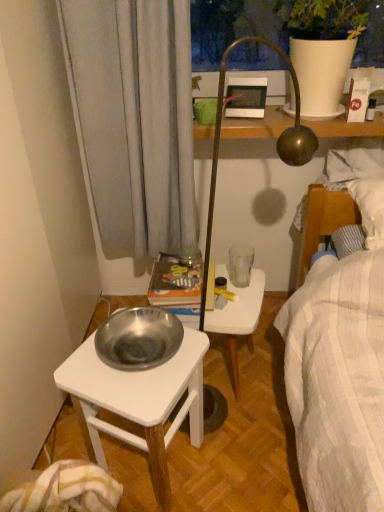
What is the approximate width of silver metallic bowl at lower left?

The width of silver metallic bowl at lower left is 12.73 inches.

This screenshot has height=512, width=384. I want to click on white plastic stool at center, so click(238, 315).

From a real-world perspective, between transparent glass at right and white plastic stool at center, who is vertically higher?

transparent glass at right is physically above.

The width and height of the screenshot is (384, 512). Identify the location of stool below the transparent glass at right (from the image's perspective). coord(238,315).

What's the angular difference between transparent glass at right and white plastic stool at center's facing directions?

They differ by 76 degrees in their facing directions.

Is point (246, 273) positioned behind point (253, 282)?

That is True.

I want to click on stool located underneath the matte white picture frame at upper center (from a real-world perspective), so click(238, 315).

Which is closer to the camera, [244,99] or [228,310]?

Point [244,99].

Between matte white picture frame at upper center and white plastic stool at center, which one has more height?

white plastic stool at center is taller.

I want to click on coffee cup that is above the orange paper book at center (from the image's perspective), so click(241, 264).

In the image, is orange paper book at center on the left side or the right side of transparent glass at right?

orange paper book at center is positioned on transparent glass at right's left side.

Considering the relative sizes of orange paper book at center and transparent glass at right in the image provided, is orange paper book at center bigger than transparent glass at right?

Yes.

From a real-world perspective, is orange paper book at center over transparent glass at right?

Yes, from a real-world perspective, orange paper book at center is above transparent glass at right.

Which is more to the left, matte white picture frame at upper center or silver metallic bowl at lower left?

From the viewer's perspective, silver metallic bowl at lower left appears more on the left side.

How distant is matte white picture frame at upper center from silver metallic bowl at lower left?

matte white picture frame at upper center is 93.44 centimeters away from silver metallic bowl at lower left.

How many degrees apart are the facing directions of matte white picture frame at upper center and silver metallic bowl at lower left?

There is a 77.4-degree angle between the facing directions of matte white picture frame at upper center and silver metallic bowl at lower left.

Where is `desk that is in front of the matte white picture frame at upper center`? The image size is (384, 512). desk that is in front of the matte white picture frame at upper center is located at coordinates (140, 401).

Is white plastic stool at center behind matte white picture frame at upper center?

No, white plastic stool at center is closer to the camera.

Is point (245, 319) closer to viewer compared to point (241, 115)?

Yes.

Is white plastic stool at center not inside matte white picture frame at upper center?

Yes, white plastic stool at center is located beyond the bounds of matte white picture frame at upper center.

Could you tell me if white plastic stool at center is facing matte white picture frame at upper center?

No, white plastic stool at center does not turn towards matte white picture frame at upper center.

From a real-world perspective, does matte white picture frame at upper center sit lower than transparent glass at right?

Incorrect, from a real-world perspective, matte white picture frame at upper center is higher than transparent glass at right.

Is there a large distance between matte white picture frame at upper center and transparent glass at right?

No, matte white picture frame at upper center is in close proximity to transparent glass at right.

Does matte white picture frame at upper center have a greater height compared to transparent glass at right?

Correct, matte white picture frame at upper center is much taller as transparent glass at right.

Considering the sizes of objects matte white picture frame at upper center and transparent glass at right in the image provided, who is thinner, matte white picture frame at upper center or transparent glass at right?

matte white picture frame at upper center is thinner.

Which is less distant, (178, 302) or (238, 110)?

Point (178, 302) appears to be closer to the viewer than point (238, 110).

Who is taller, orange paper book at center or matte white picture frame at upper center?

matte white picture frame at upper center is taller.

Which object is further away from the camera, orange paper book at center or matte white picture frame at upper center?

matte white picture frame at upper center is behind.

Would you say orange paper book at center is outside matte white picture frame at upper center?

Absolutely, orange paper book at center is external to matte white picture frame at upper center.

Image resolution: width=384 pixels, height=512 pixels. Find the location of `coffee cup above the white plastic stool at center (from a real-world perspective)`. coffee cup above the white plastic stool at center (from a real-world perspective) is located at coordinates (241, 264).

This screenshot has height=512, width=384. Find the location of `stool on the left of the matte white picture frame at upper center`. stool on the left of the matte white picture frame at upper center is located at coordinates (238, 315).

Which object lies nearer to the anchor point silver metallic bowl at lower left, transparent glass at right or matte white picture frame at upper center?

Based on the image, transparent glass at right appears to be nearer to silver metallic bowl at lower left.

Which object lies further to the anchor point silver metallic bowl at lower left, transparent glass at right or white plastic stool at center?

The object further to silver metallic bowl at lower left is transparent glass at right.

Which object lies further to the anchor point transparent glass at right, silver metallic bowl at lower left or white plastic stool at center?

silver metallic bowl at lower left lies further to transparent glass at right than the other object.

Looking at the image, which one is located closer to orange paper book at center, matte white picture frame at upper center or transparent glass at right?

Based on the image, transparent glass at right appears to be nearer to orange paper book at center.

When comparing their distances from white plastic stool at center, does transparent glass at right or orange paper book at center seem closer?

transparent glass at right.

Which object lies nearer to the anchor point matte white picture frame at upper center, transparent glass at right or white plastic stool at center?

Based on the image, transparent glass at right appears to be nearer to matte white picture frame at upper center.

From the image, which object appears to be nearer to white plastic stool at center, silver metallic bowl at lower left or matte white picture frame at upper center?

silver metallic bowl at lower left is positioned closer to the anchor white plastic stool at center.

Based on their spatial positions, is white plastic stool at center or matte white picture frame at upper center further from orange paper book at center?

Based on the image, matte white picture frame at upper center appears to be further to orange paper book at center.

Identify the location of stool between silver metallic bowl at lower left and transparent glass at right along the z-axis. (238, 315).

Where is `stool that lies between matte white picture frame at upper center and silver metallic bowl at lower left from top to bottom`? The width and height of the screenshot is (384, 512). stool that lies between matte white picture frame at upper center and silver metallic bowl at lower left from top to bottom is located at coordinates tap(238, 315).

Identify the location of book between matte white picture frame at upper center and silver metallic bowl at lower left in the vertical direction. (177, 288).

Where is `book between silver metallic bowl at lower left and transparent glass at right in the front-back direction`? This screenshot has height=512, width=384. book between silver metallic bowl at lower left and transparent glass at right in the front-back direction is located at coordinates (177, 288).